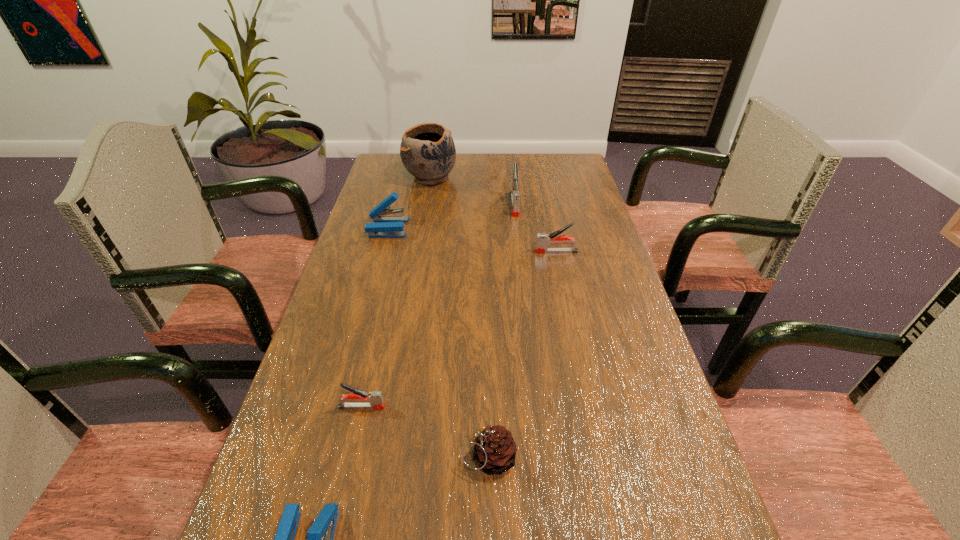
Image resolution: width=960 pixels, height=540 pixels. I want to click on the nearest gray stapler, so click(x=375, y=398).

Identify the location of the smallest gray stapler. The height and width of the screenshot is (540, 960). [375, 398].

Identify the location of vacant space located 0.210m on the right of the tallest object. (516, 177).

Where is `free spot located 0.170m on the handle side of the sixth shortest object`? free spot located 0.170m on the handle side of the sixth shortest object is located at coordinates (519, 249).

The width and height of the screenshot is (960, 540). In order to click on free spot located 0.240m on the handle side of the rightmost object in this screenshot , I will do `click(450, 252)`.

This screenshot has height=540, width=960. I want to click on blank space located on the handle side of the rightmost object, so click(437, 252).

Find the location of a particular element. The height and width of the screenshot is (540, 960). vacant space located 0.070m on the handle side of the rightmost object is located at coordinates (511, 252).

What are the coordinates of `free space located on the right of the bigger blue stapler` in the screenshot? It's located at (424, 227).

Identify the location of vacant space located 0.300m with a leaf charm attached to the pinecone. (297, 457).

Locate an element on the screen. The image size is (960, 540). free space located with a leaf charm attached to the pinecone is located at coordinates (291, 457).